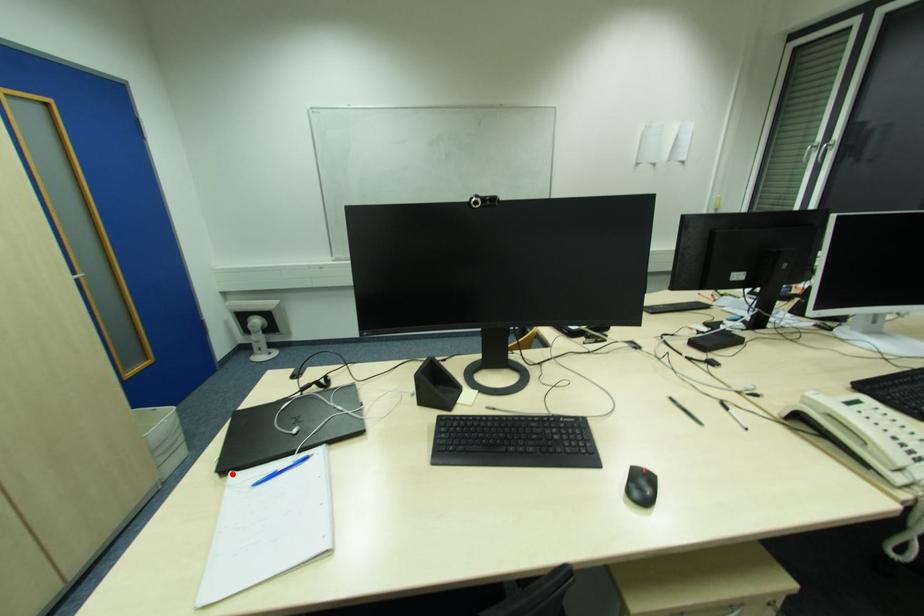
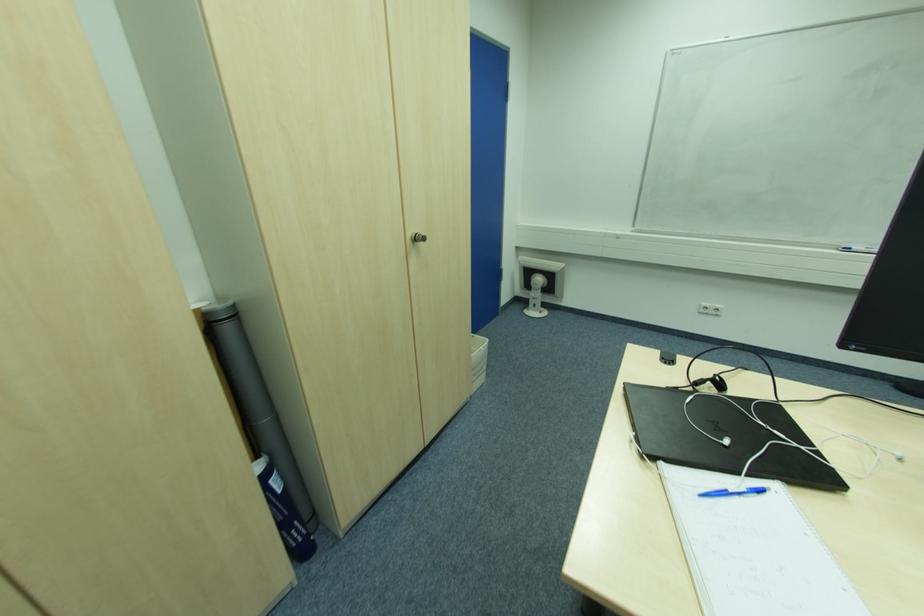
In the second image, find the point that corresponds to the highlighted location in the first image.

(663, 464)